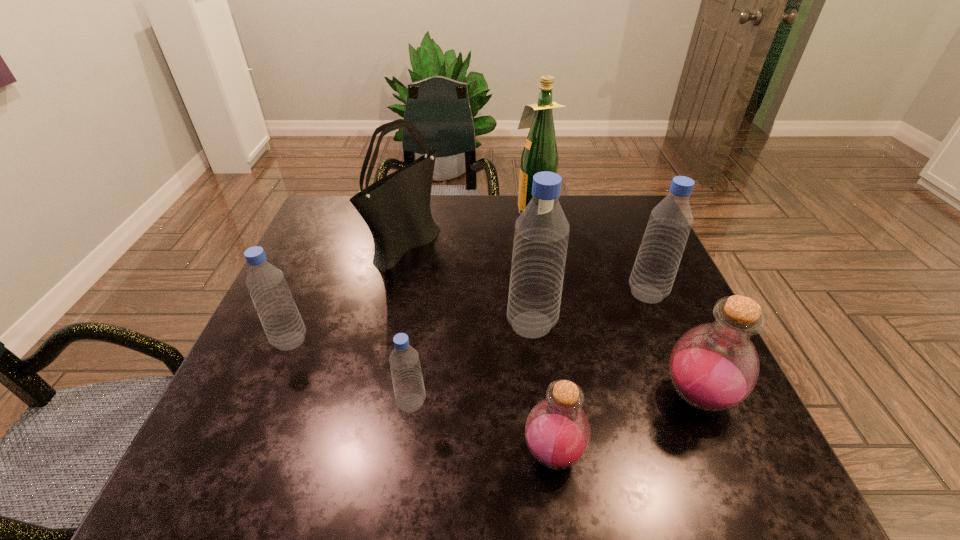
Locate an element on the screen. The width and height of the screenshot is (960, 540). free space between the left purple bottle and the shoulder bag is located at coordinates (480, 348).

You are a GUI agent. You are given a task and a screenshot of the screen. Output one action in this format:
    pyautogui.click(x=<x>, y=<y>)
    Task: Click on the free space between the farthest blue bottle and the liquor
    The height and width of the screenshot is (540, 960).
    Given the screenshot: What is the action you would take?
    pyautogui.click(x=589, y=252)

You are a GUI agent. You are given a task and a screenshot of the screen. Output one action in this format:
    pyautogui.click(x=<x>, y=<y>)
    Task: Click on the object that is the fourth closest one to the liquor
    Image resolution: width=960 pixels, height=540 pixels.
    Given the screenshot: What is the action you would take?
    pyautogui.click(x=713, y=367)

Locate which object is the seventh closest to the leftmost object. Please provide its 2D coordinates. Your answer should be formatted as a tuple, i.e. [(x, y)], where the tuple contains the x and y coordinates of a point satisfying the conditions above.

[(669, 225)]

At what (x,y) coordinates should I click in order to perform the action: click on the closest bottle to the liquor. Please return your answer as a coordinate pair (x, y). Looking at the image, I should click on (669, 225).

This screenshot has width=960, height=540. I want to click on bottle that is the fifth closest to the second blue bottle from right to left, so click(278, 313).

You are a GUI agent. You are given a task and a screenshot of the screen. Output one action in this format:
    pyautogui.click(x=<x>, y=<y>)
    Task: Click on the blue bottle that is the closest to the nearest blue bottle
    Image resolution: width=960 pixels, height=540 pixels.
    Given the screenshot: What is the action you would take?
    pyautogui.click(x=541, y=235)

Where is `the closest blue bottle to the nearest blue bottle`? The height and width of the screenshot is (540, 960). the closest blue bottle to the nearest blue bottle is located at coordinates coord(541,235).

I want to click on vacant space that satisfies the following two spatial constraints: 1. on the back side of the rightmost blue bottle; 2. on the left side of the left purple bottle, so click(x=533, y=294).